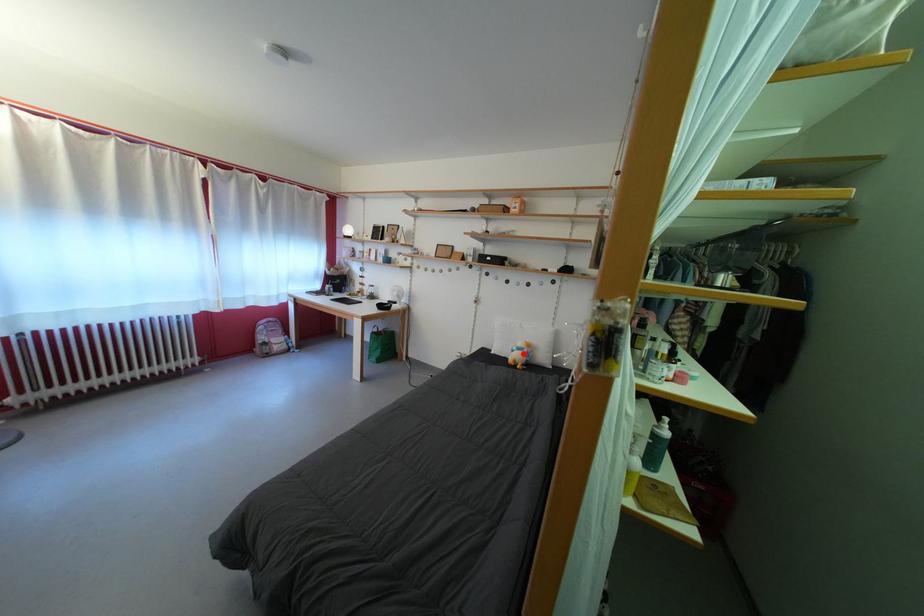
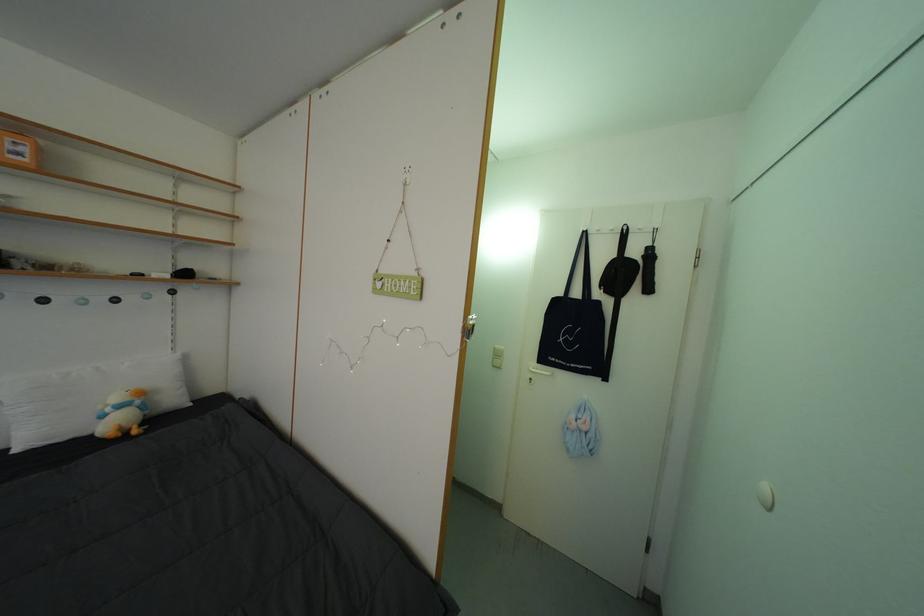
Question: I am providing you with two images of the same scene from different viewpoints. A red point is marked on the first image. At the location where the point appears in image 1, is it still visible in image 2?

Choices:
 (A) Yes
 (B) No

Answer: (A)